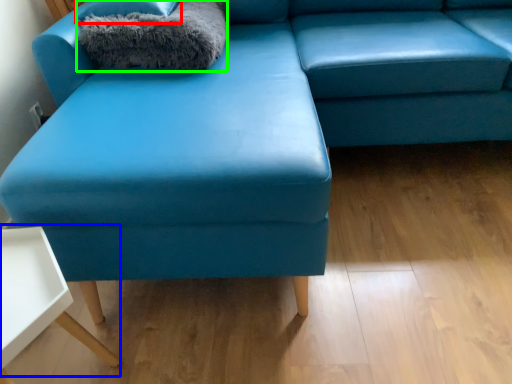
Question: Which is nearer to the pillow (highlighted by a red box)? table (highlighted by a blue box) or blanket (highlighted by a green box).

Choices:
 (A) table
 (B) blanket

Answer: (B)